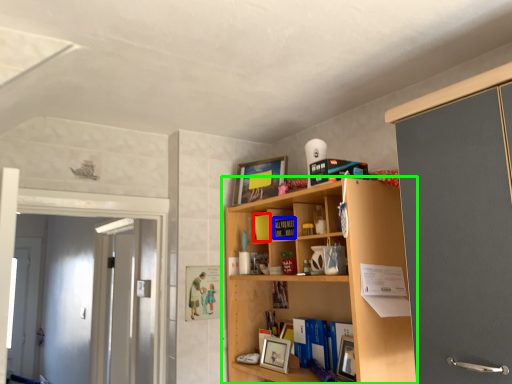
Question: Based on their relative distances, which object is nearer to book (highlighted by a red box)? Choose from book (highlighted by a blue box) and shelf (highlighted by a green box).

Choices:
 (A) book
 (B) shelf

Answer: (A)